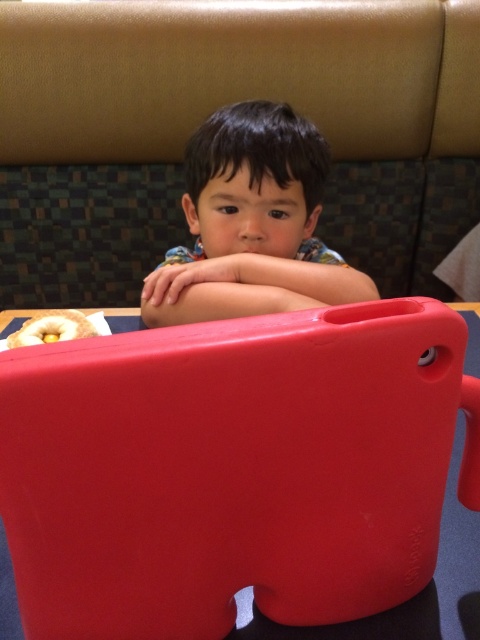
Question: Is matte black child at center to the left of glazed doughnut at lower left from the viewer's perspective?

Choices:
 (A) no
 (B) yes

Answer: (A)

Question: Among these objects, which one is farthest from the camera?

Choices:
 (A) glazed doughnut at lower left
 (B) matte black child at center

Answer: (A)

Question: Observing the image, what is the correct spatial positioning of matte black child at center in reference to glazed doughnut at lower left?

Choices:
 (A) below
 (B) above

Answer: (B)

Question: Is matte black child at center further to the viewer compared to glazed doughnut at lower left?

Choices:
 (A) yes
 (B) no

Answer: (B)

Question: Which of the following is the closest to the observer?

Choices:
 (A) (54, 316)
 (B) (217, 285)

Answer: (B)